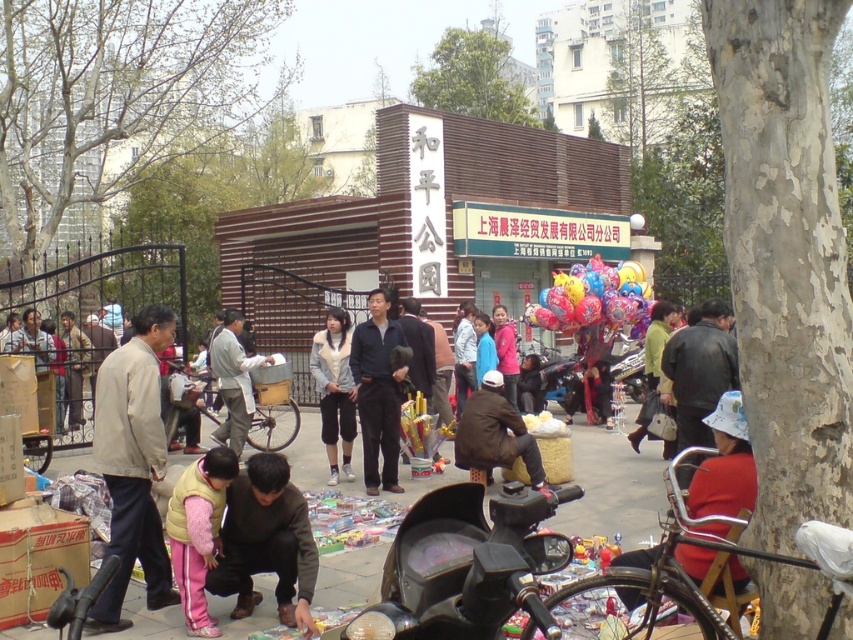
You are a photographer trying to capture both the dark blue fleece jacket at center and the light gray fabric jacket at center in a single frame. Since you want both jackets to be fully visible, which jacket should you focus on to ensure the other doesn t get cropped out?

The dark blue fleece jacket at center is much taller than the light gray fabric jacket at center. To ensure both are fully visible in the frame, focus on the taller jacket, the dark blue fleece jacket at center, and adjust the camera angle to include the shorter light gray fabric jacket at center as well.

You are a photographer standing at the camera position in the Peace Park market scene. You want to capture a photo of the glossy plastic balloons at center without including any people in the frame. Given that the balloons are 19.90 meters away from you, what is the minimum distance you need to move backward to ensure no people are in the shot?

The glossy plastic balloons at center are 19.90 meters away from the camera. To avoid including people in the frame, you would need to move backward at least 19.90 meters to ensure the balloons remain in focus while distancing yourself from any nearby individuals.